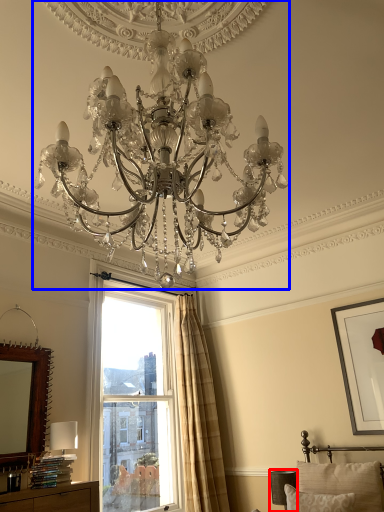
Question: Which of the following is the closest to the observer, table lamp (highlighted by a red box) or lamp (highlighted by a blue box)?

Choices:
 (A) table lamp
 (B) lamp

Answer: (B)